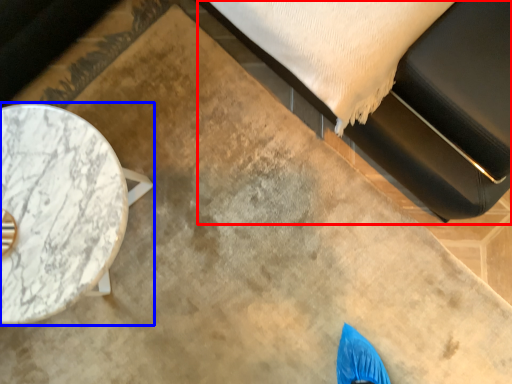
Question: Which of the following is the closest to the observer, bed (highlighted by a red box) or table (highlighted by a blue box)?

Choices:
 (A) bed
 (B) table

Answer: (A)